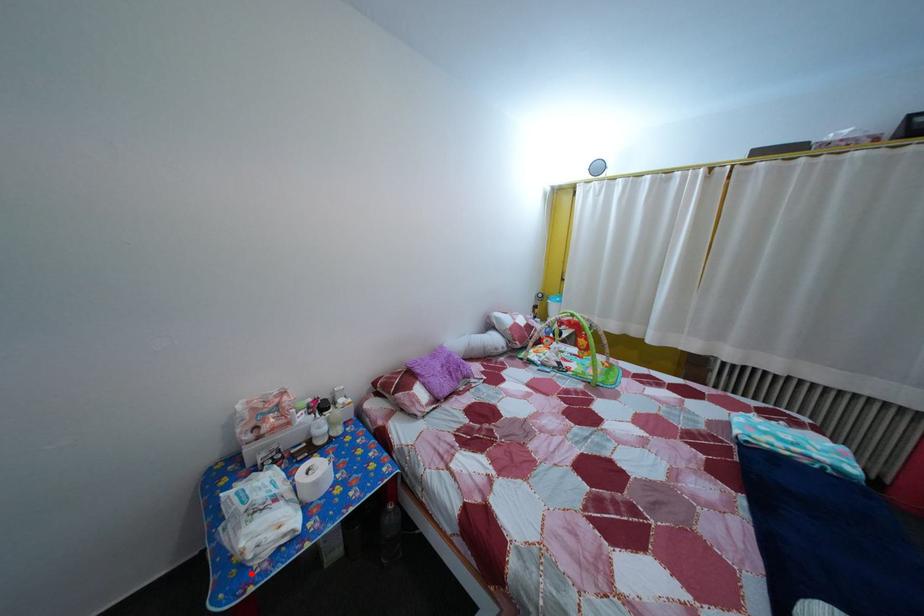
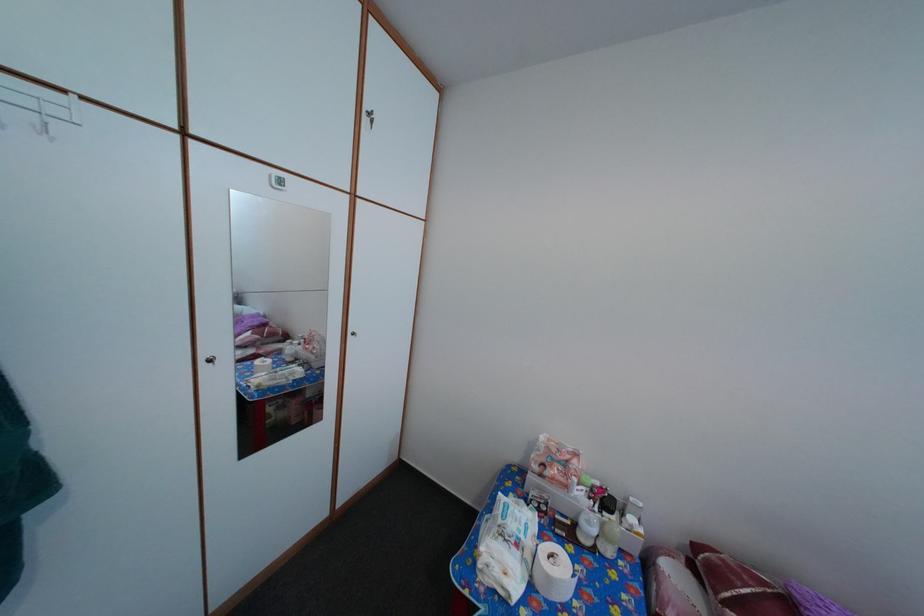
Question: I am providing you with two images of the same scene from different viewpoints. Image1 has a red point marked. In image2, the corresponding 3D location appears at what relative position? Reply with the corresponding letter.

Choices:
 (A) Closer
 (B) Farther

Answer: (B)